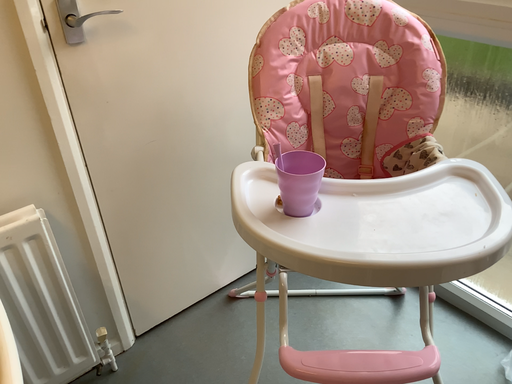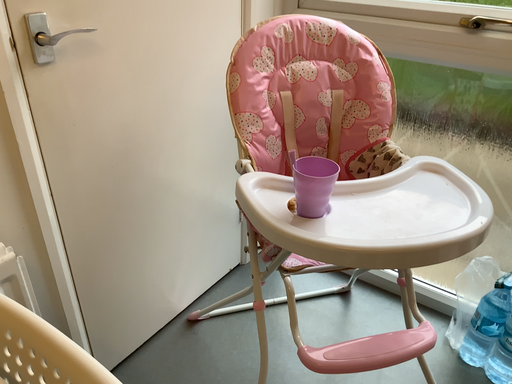
Question: How did the camera likely rotate when shooting the video?

Choices:
 (A) rotated left
 (B) rotated right

Answer: (B)